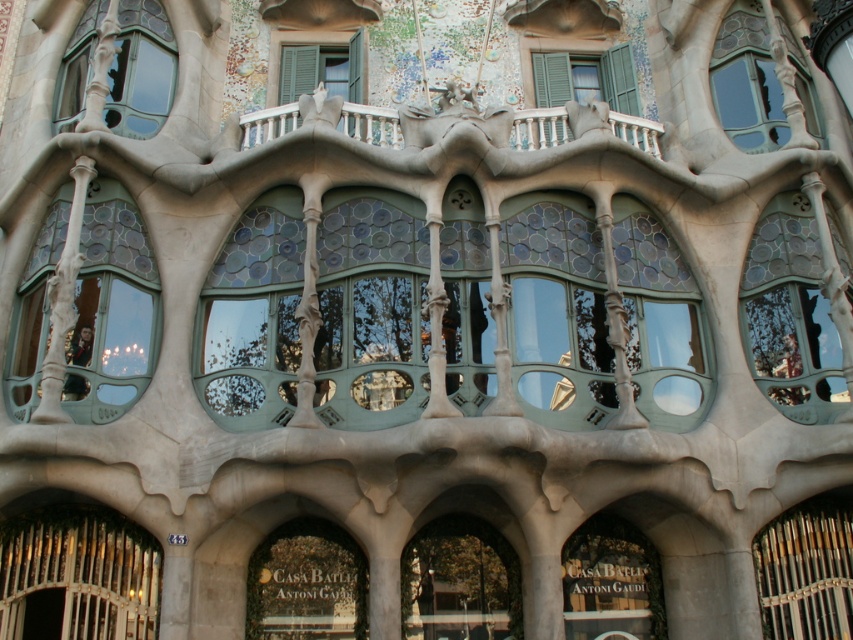
Based on the scene description of Casa Batll? 1. What is the object located at point (x=140, y=68)?

The object located at point (x=140, y=68) is a translucent glass window at upper left.

You are an architect analyzing the facade of Casa Batll? You observe the green glass window at center and the transparent glass window at upper right. Which window is located lower on the building?

The green glass window at center is positioned under the transparent glass window at upper right, so it is located lower on the building.

You are an architect analyzing the facade of Casa Batll. You observe the green glass window at center and the transparent glass window at upper right. Which of these two windows is shorter in height?

The green glass window at center has a lesser height compared to the transparent glass window at upper right, so the green glass window at center is shorter in height.